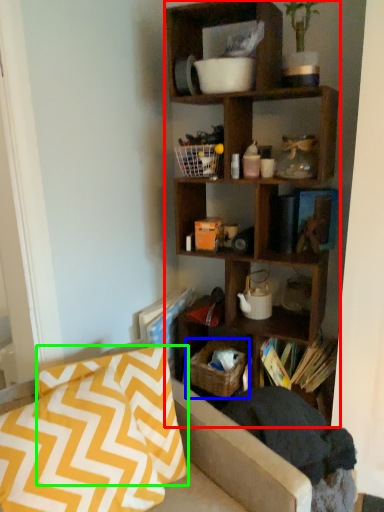
Question: Which object is the closest to the shelf (highlighted by a red box)? Choose among these: crate (highlighted by a blue box) or pillow (highlighted by a green box).

Choices:
 (A) crate
 (B) pillow

Answer: (A)